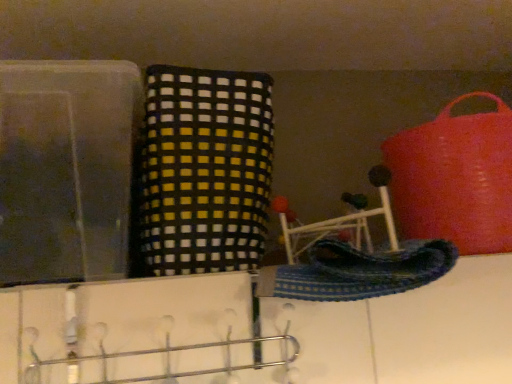
What do you see at coordinates (66, 168) in the screenshot?
I see `transparent plastic box at left` at bounding box center [66, 168].

Find the location of a particular element. The height and width of the screenshot is (384, 512). transparent plastic box at left is located at coordinates (66, 168).

Find the location of a particular element. The height and width of the screenshot is (384, 512). transparent plastic box at left is located at coordinates (66, 168).